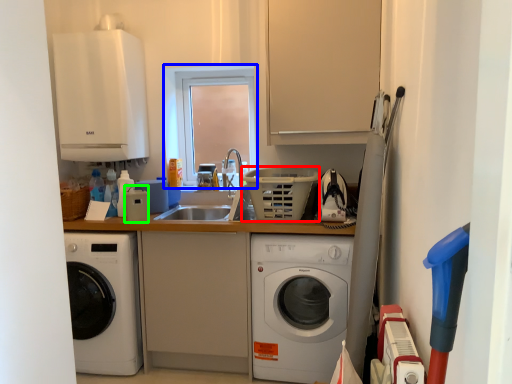
Question: Considering the real-world distances, which object is closest to basket (highlighted by a red box)? window (highlighted by a blue box) or appliance (highlighted by a green box).

Choices:
 (A) window
 (B) appliance

Answer: (A)